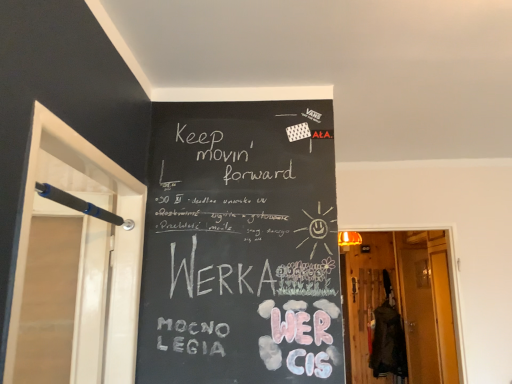
Question: Is point (79, 150) closer or farther from the camera than point (387, 259)?

Choices:
 (A) farther
 (B) closer

Answer: (B)

Question: Do you think black plastic screen door at left, the second screen door viewed from the right, is within wooden door at center, or outside of it?

Choices:
 (A) outside
 (B) inside

Answer: (A)

Question: Which object is positioned farthest from the black plastic screen door at left, placed as the second screen door when sorted from back to front?

Choices:
 (A) translucent glass screen door at right, the first screen door positioned from the bottom
 (B) wooden door at center

Answer: (A)

Question: Based on their relative distances, which object is nearer to the translucent glass screen door at right, the first screen door positioned from the bottom?

Choices:
 (A) wooden door at center
 (B) black plastic screen door at left, the 1th screen door when ordered from left to right

Answer: (A)